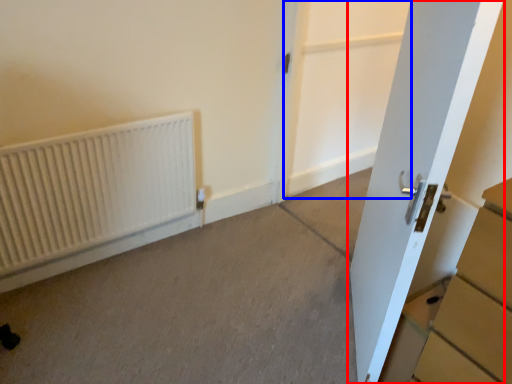
Question: Which object is further to the camera taking this photo, door (highlighted by a red box) or screen door (highlighted by a blue box)?

Choices:
 (A) door
 (B) screen door

Answer: (B)